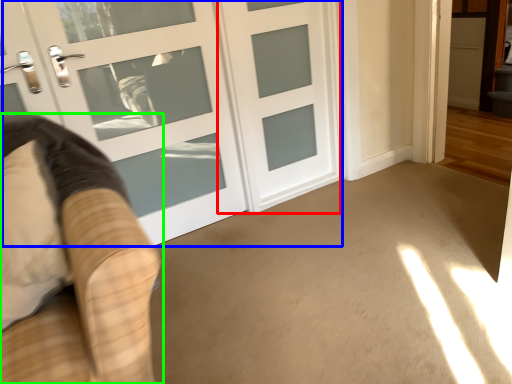
Question: Based on their relative distances, which object is farther from door (highlighted by a red box)? Choose from door (highlighted by a blue box) and furniture (highlighted by a green box).

Choices:
 (A) door
 (B) furniture

Answer: (B)